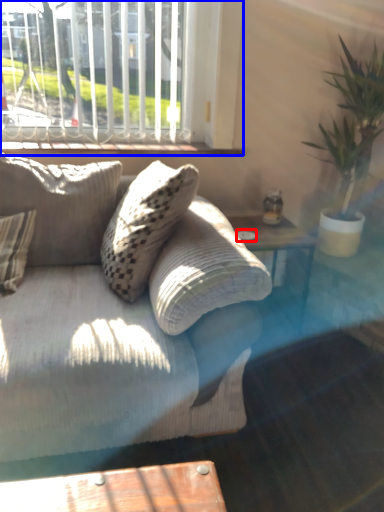
Question: Which of the following is the farthest to the observer, glass plate (highlighted by a red box) or window (highlighted by a blue box)?

Choices:
 (A) glass plate
 (B) window

Answer: (A)